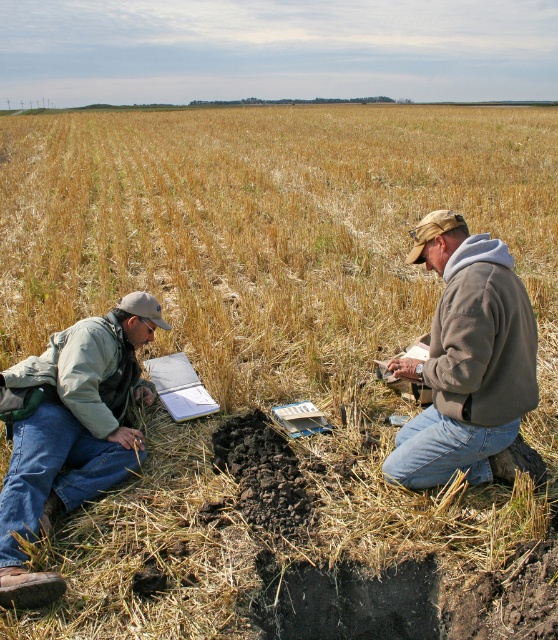
Based on the photo, you are a researcher in the field and need to retrieve a soil sample from the pit. You are currently standing near the denim jeans at lower left and the brown fleece jacket at right. Which direction should you move to reach the soil pit?

The denim jeans at lower left is to the left of brown fleece jacket at right, so you should move towards the denim jeans at lower left to reach the soil pit.

You are a farmer assessing the field. You see the denim jeans at lower left and the brown fleece jacket at right. Which clothing item is closer to the ground?

The denim jeans at lower left has a lesser height compared to the brown fleece jacket at right, so the denim jeans at lower left is closer to the ground.